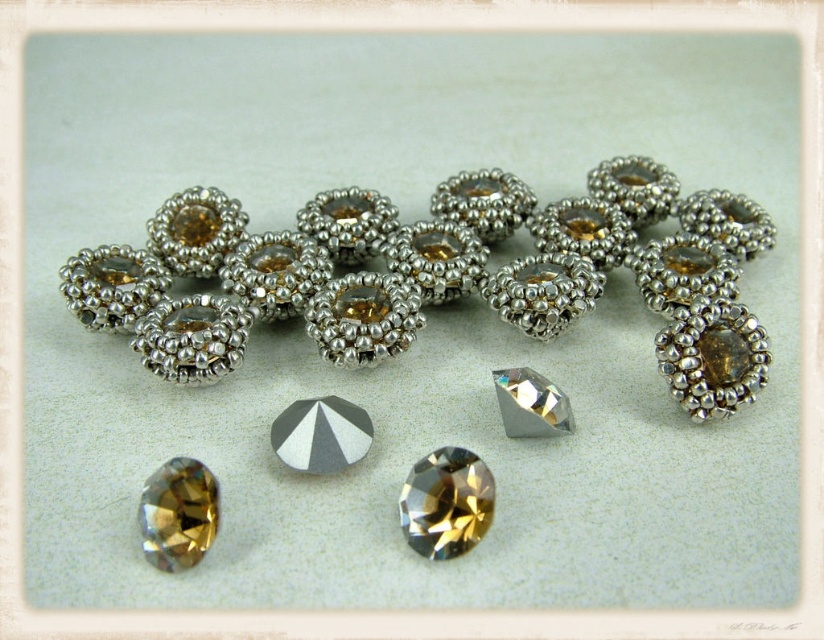
Looking at this image, you are an artisan crafting a necklace and need to choose between the silver metallic beads at center and the faceted gold diamond at center. Based on their positions in the image, which one is closer to you?

The silver metallic beads at center are closer to you because the faceted gold diamond at center is positioned behind them.

You are a jeweler examining the image. You need to determine which object is taller between the silver metallic beads at center and the faceted gold diamond at center. Which one is taller?

The silver metallic beads at center has a greater height compared to the faceted gold diamond at center, so the silver metallic beads at center is taller.